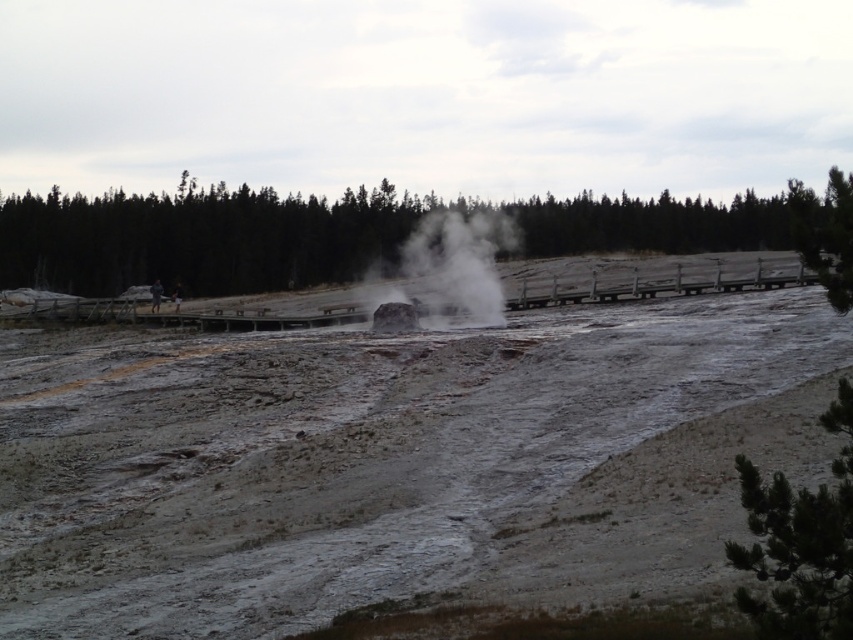
You are a park ranger guiding visitors on a tour of this geothermal area. You want to ensure everyone stays on the wooden walkway for safety. If the steamy mud at center is located at coordinates 0.706, 0.394, can you confirm whether this mud is positioned directly in the middle of the walkway or closer to one end?

The steamy mud at center is located at coordinates (335, 451). Since the coordinates are not exactly (426, 320), it is closer to the right side of the walkway, so it is not directly in the middle.

You are a park ranger guiding visitors on a tour of the geothermal area. You want to ensure everyone stays on the wooden walkway for safety. Pointing to the point marked as point [335,451], which is the location of the steamy mud at center, explain why visitors must not step off the walkway near this area.

The point [335,451] marks the location of the steamy mud at center, which indicates an active geothermal area. Stepping off the walkway here could lead to burns from hot ground or unstable terrain, so visitors must stay on the wooden walkway for their safety.